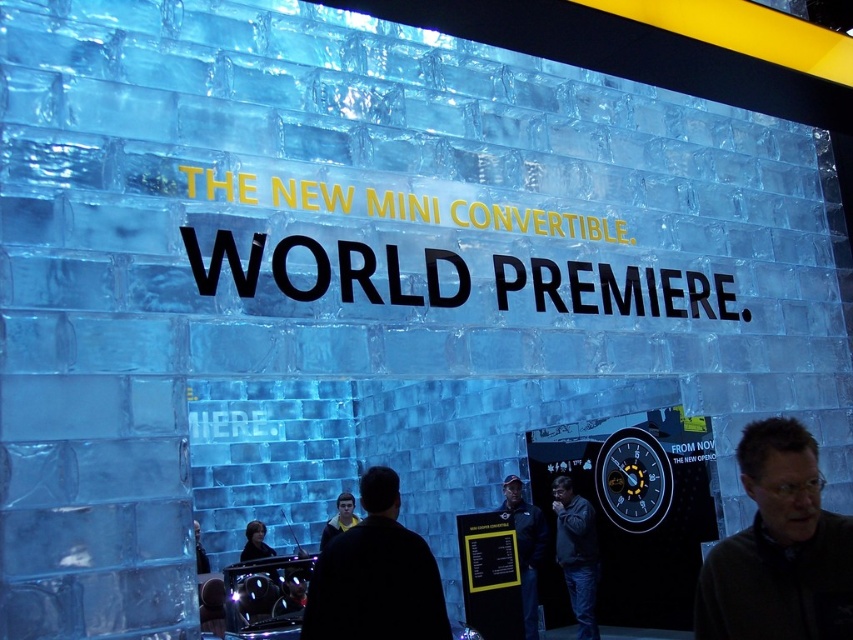
Can you confirm if dark gray sweater at center is wider than dark gray jacket at center?

Yes.

Is dark gray sweater at center closer to camera compared to dark gray jacket at center?

That is True.

Who is more distant from viewer, (x=712, y=589) or (x=560, y=548)?

Positioned behind is point (x=560, y=548).

Identify the location of dark gray sweater at center. (778, 548).

Who is higher up, dark gray sweater at center or dark blue jacket at center?

Positioned higher is dark gray sweater at center.

Who is more forward, (825, 636) or (514, 525)?

Positioned in front is point (825, 636).

The height and width of the screenshot is (640, 853). In order to click on dark gray sweater at center in this screenshot , I will do `click(778, 548)`.

The image size is (853, 640). I want to click on dark gray sweater at center, so click(x=778, y=548).

Between black matte jacket at center and dark blue jacket at center, which one appears on the right side from the viewer's perspective?

dark blue jacket at center

Describe the element at coordinates (375, 576) in the screenshot. I see `black matte jacket at center` at that location.

You are a GUI agent. You are given a task and a screenshot of the screen. Output one action in this format:
    pyautogui.click(x=<x>, y=<y>)
    Task: Click on the black matte jacket at center
    
    Given the screenshot: What is the action you would take?
    pyautogui.click(x=375, y=576)